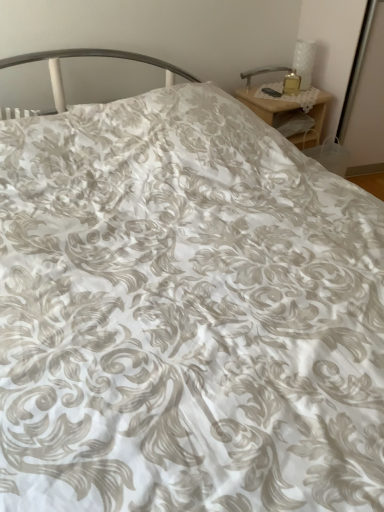
Question: Does point (289, 69) appear closer or farther from the camera than point (311, 71)?

Choices:
 (A) closer
 (B) farther

Answer: (B)

Question: From a real-world perspective, is metallic silver table lamp at upper right, marked as the 1th table lamp in a left-to-right arrangement, positioned above or below white textured vase at upper right, acting as the first table lamp starting from the right?

Choices:
 (A) above
 (B) below

Answer: (B)

Question: Estimate the real-world distances between objects in this image. Which object is closer to the wooden nightstand at upper right?

Choices:
 (A) metallic silver table lamp at upper right, which is the 2th table lamp from right to left
 (B) white textured vase at upper right, acting as the 2th table lamp starting from the left

Answer: (A)

Question: Which of these objects is positioned closest to the wooden nightstand at upper right?

Choices:
 (A) white textured vase at upper right, acting as the first table lamp starting from the right
 (B) metallic silver table lamp at upper right, which is the 2th table lamp from right to left

Answer: (B)